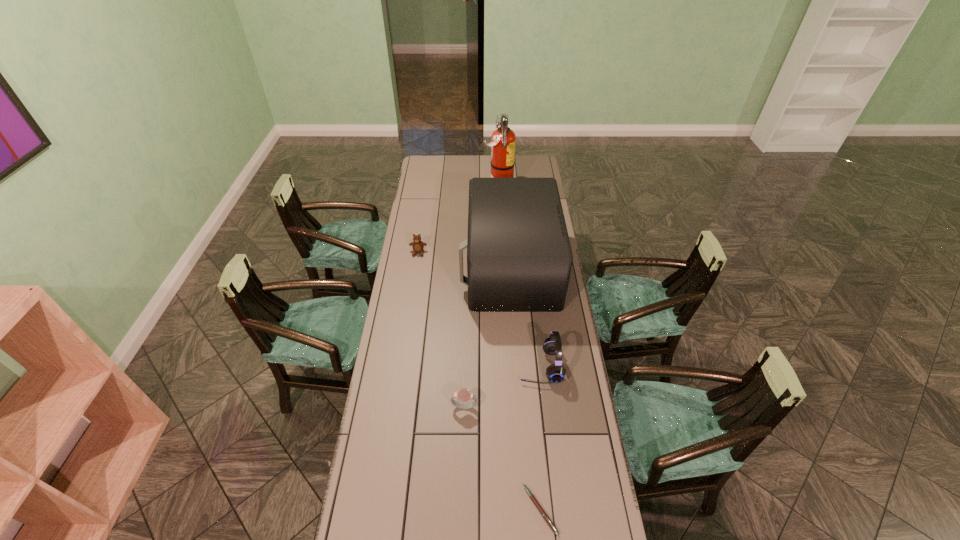
The height and width of the screenshot is (540, 960). I want to click on free space at the left edge of the desktop, so click(x=421, y=284).

In the image, there is a desktop. Find the location of `free space at the right edge`. free space at the right edge is located at coordinates (599, 512).

Where is `free space at the far left corner`? The image size is (960, 540). free space at the far left corner is located at coordinates (431, 175).

Find the location of a particular element. This screenshot has width=960, height=540. vacant area that lies between the nearest object and the microwave oven is located at coordinates (525, 389).

In order to click on empty space between the second tallest object and the second nearest object in this screenshot , I will do `click(487, 337)`.

Identify the location of vacant area that lies between the leftmost object and the tallest object. (458, 221).

Where is `vacant region between the second nearest object and the shortest object`? This screenshot has width=960, height=540. vacant region between the second nearest object and the shortest object is located at coordinates (502, 458).

Where is `free spot between the nearest object and the fifth tallest object`? Image resolution: width=960 pixels, height=540 pixels. free spot between the nearest object and the fifth tallest object is located at coordinates (502, 458).

Where is `blank region between the fifth farthest object and the leftmost object`? The width and height of the screenshot is (960, 540). blank region between the fifth farthest object and the leftmost object is located at coordinates (442, 329).

In order to click on vacant area that lies between the microwave oven and the nearest object in this screenshot , I will do click(x=525, y=389).